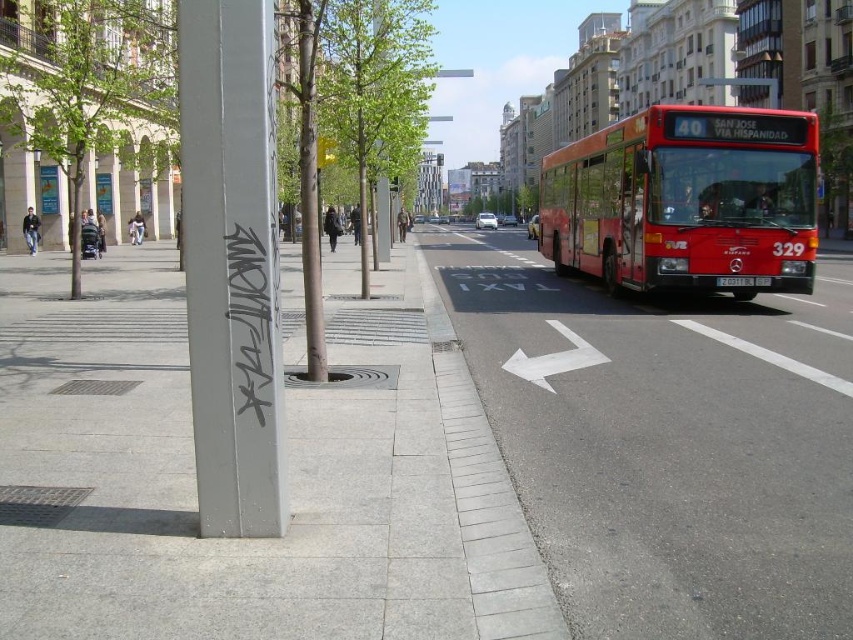
Measure the distance between gray concrete curb at lower center and camera.

gray concrete curb at lower center is 10.82 feet from camera.

At what (x,y) coordinates should I click in order to perform the action: click on gray concrete curb at lower center. Please return your answer as a coordinate pair (x, y). Looking at the image, I should click on (485, 497).

Who is taller, gray concrete sidewalk at center or green leafy tree at center?

With more height is green leafy tree at center.

Consider the image. Is gray concrete sidewalk at center behind green leafy tree at center?

No, gray concrete sidewalk at center is closer to the viewer.

What do you see at coordinates (287, 474) in the screenshot? I see `gray concrete sidewalk at center` at bounding box center [287, 474].

I want to click on gray concrete sidewalk at center, so click(x=287, y=474).

Who is more forward, [190,636] or [183,45]?

Point [190,636] is more forward.

Does gray concrete sidewalk at center have a smaller size compared to metallic pole at left?

No, gray concrete sidewalk at center is not smaller than metallic pole at left.

Is point (131, 428) positioned in front of point (223, 420)?

No, (131, 428) is further to viewer.

Find the location of `gray concrete sidewalk at center`. gray concrete sidewalk at center is located at coordinates (287, 474).